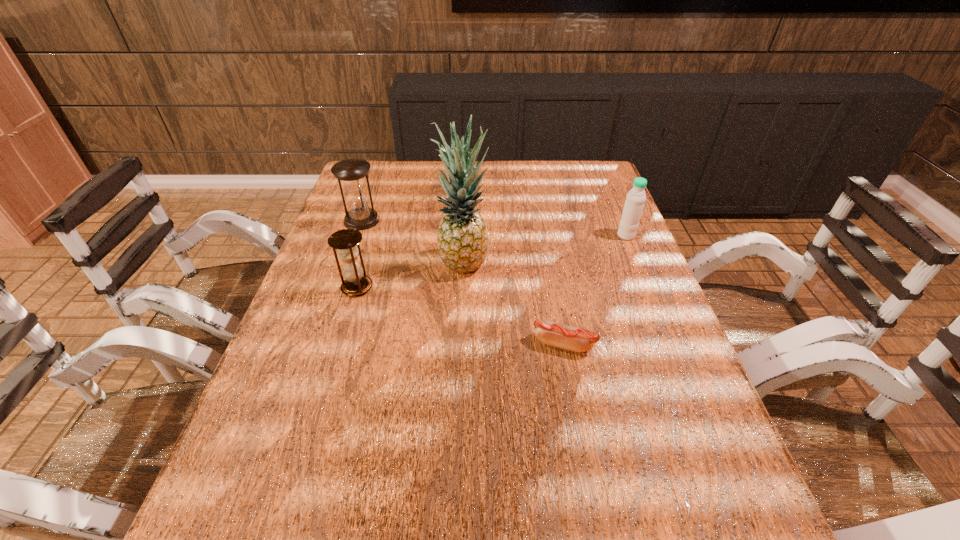
You are a GUI agent. You are given a task and a screenshot of the screen. Output one action in this format:
    pyautogui.click(x=<x>, y=<y>)
    Task: Click on the pineapple
    This screenshot has width=960, height=540.
    Given the screenshot: What is the action you would take?
    pyautogui.click(x=462, y=240)

This screenshot has width=960, height=540. In order to click on the third object from left to right in this screenshot , I will do click(x=462, y=240).

This screenshot has width=960, height=540. In order to click on the rightmost object in this screenshot , I will do `click(634, 204)`.

Locate an element on the screen. This screenshot has width=960, height=540. the farther hourglass is located at coordinates (352, 172).

You are a GUI agent. You are given a task and a screenshot of the screen. Output one action in this format:
    pyautogui.click(x=<x>, y=<y>)
    Task: Click on the nearer hourglass
    
    Given the screenshot: What is the action you would take?
    pyautogui.click(x=355, y=284)

At what (x,y) coordinates should I click in order to perform the action: click on the shortest object. Please return your answer as a coordinate pair (x, y). Looking at the image, I should click on (575, 339).

I want to click on sausage, so click(x=575, y=339).

You are a GUI agent. You are given a task and a screenshot of the screen. Output one action in this format:
    pyautogui.click(x=<x>, y=<y>)
    Task: Click on the vacant space situated on the front of the tallest object
    This screenshot has width=960, height=540.
    Given the screenshot: What is the action you would take?
    pyautogui.click(x=458, y=379)

The image size is (960, 540). I want to click on free space located 0.260m on the back of the rightmost object, so click(606, 185).

What are the coordinates of `free space located on the back of the farther hourglass` in the screenshot? It's located at (372, 190).